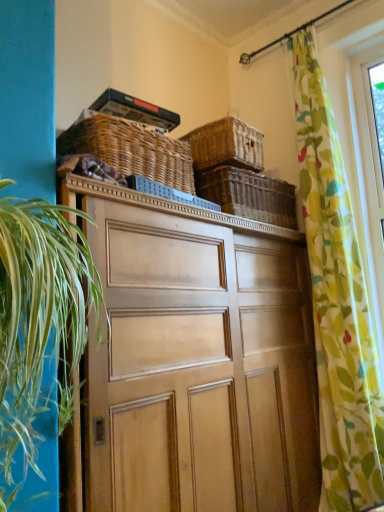
Question: Considering the relative positions of green leafy plant at left and woven wicker basket at upper center, the third basket when ordered from left to right, in the image provided, is green leafy plant at left to the left or to the right of woven wicker basket at upper center, the third basket when ordered from left to right,?

Choices:
 (A) right
 (B) left

Answer: (B)

Question: From a real-world perspective, is green leafy plant at left above or below woven wicker basket at upper center, the third basket when ordered from left to right?

Choices:
 (A) above
 (B) below

Answer: (B)

Question: Considering the real-world distances, which object is closest to the woven brown basket at upper center, marked as the third basket in a right-to-left arrangement?

Choices:
 (A) green leafy plant at left
 (B) wooden cabinet at center
 (C) woven wicker basket at upper center, the third basket when ordered from left to right
 (D) woven brown basket at upper center, which is counted as the 2th basket, starting from the left
 (E) floral fabric curtain at right

Answer: (D)

Question: Which of these objects is positioned farthest from the woven brown basket at upper center, which is the 2th basket in right-to-left order?

Choices:
 (A) wooden cabinet at center
 (B) woven wicker basket at upper center, the 1th basket when ordered from right to left
 (C) floral fabric curtain at right
 (D) woven brown basket at upper center, positioned as the first basket in left-to-right order
 (E) green leafy plant at left

Answer: (E)